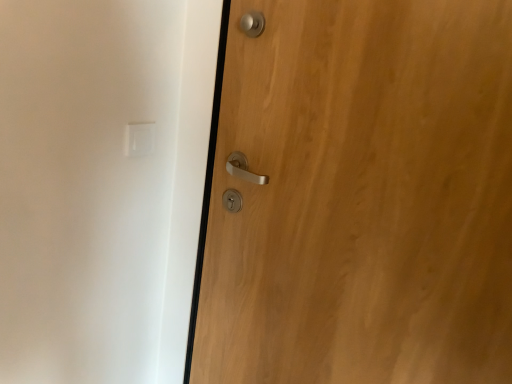
Question: Do you think wooden door at right is within white plastic light switch at upper left, or outside of it?

Choices:
 (A) inside
 (B) outside

Answer: (B)

Question: Is wooden door at right taller or shorter than white plastic light switch at upper left?

Choices:
 (A) short
 (B) tall

Answer: (B)

Question: From a real-world perspective, is wooden door at right physically located above or below white plastic light switch at upper left?

Choices:
 (A) below
 (B) above

Answer: (A)

Question: Is white plastic light switch at upper left spatially inside wooden door at right, or outside of it?

Choices:
 (A) inside
 (B) outside

Answer: (B)

Question: From a real-world perspective, is white plastic light switch at upper left positioned above or below wooden door at right?

Choices:
 (A) below
 (B) above

Answer: (B)

Question: From the image's perspective, is white plastic light switch at upper left located above or below wooden door at right?

Choices:
 (A) above
 (B) below

Answer: (A)

Question: Does point (151, 137) appear closer or farther from the camera than point (304, 372)?

Choices:
 (A) farther
 (B) closer

Answer: (A)